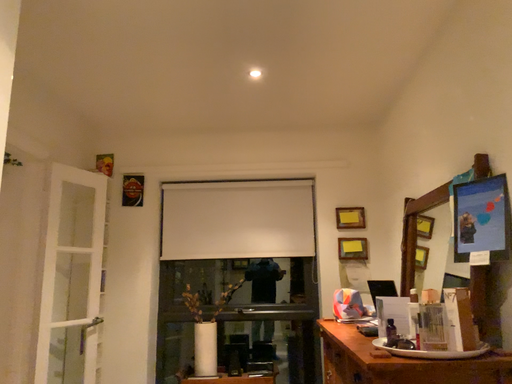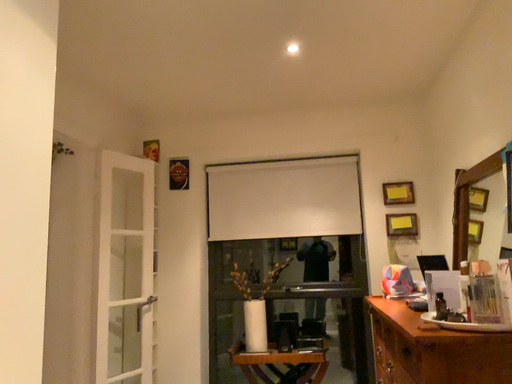
Question: Which way did the camera rotate in the video?

Choices:
 (A) rotated left
 (B) rotated right

Answer: (A)